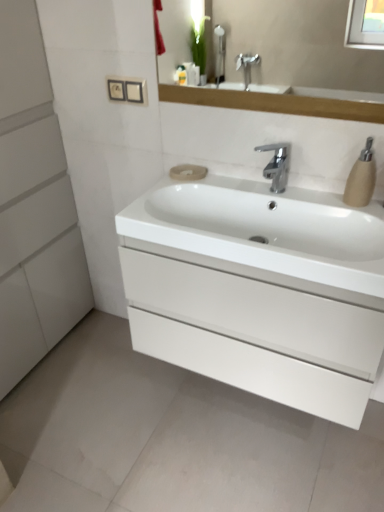
The image size is (384, 512). What are the coordinates of `vacant space underneath white glossy drawer at center (from a real-world perspective)` in the screenshot? It's located at (248, 411).